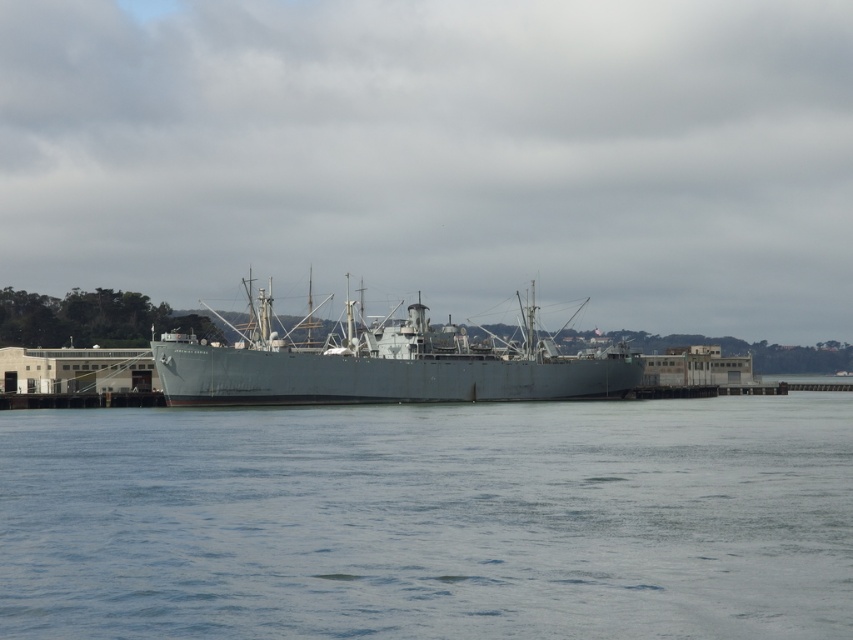
Is clear water at center wider than gray matte ship at center?

Yes.

Measure the distance between clear water at center and camera.

clear water at center is 20.33 meters from camera.

Find the location of a particular element. clear water at center is located at coordinates (430, 520).